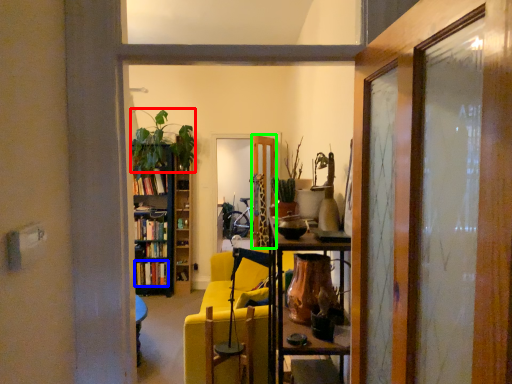
Question: Which object is the closest to the houseplant (highlighted by a red box)? Choose among these: book (highlighted by a blue box) or door (highlighted by a green box).

Choices:
 (A) book
 (B) door

Answer: (B)